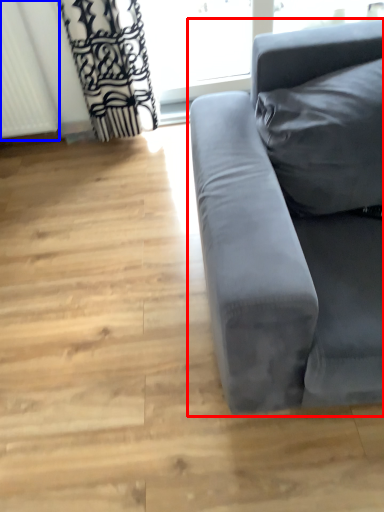
Question: Which object appears farthest to the camera in this image, studio couch (highlighted by a red box) or radiator (highlighted by a blue box)?

Choices:
 (A) studio couch
 (B) radiator

Answer: (B)